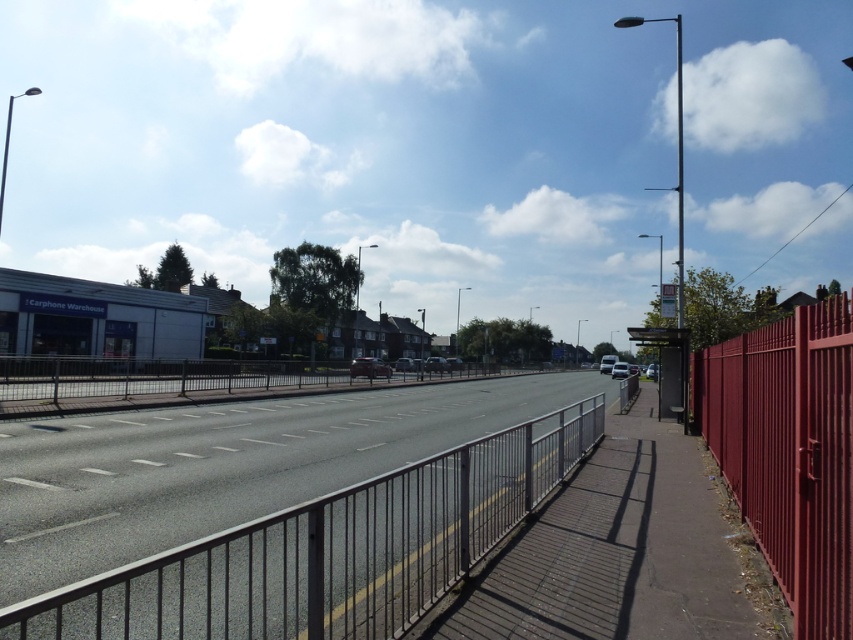
Is the position of metallic silver rail at center less distant than that of smooth glossy red fence at right?

Yes, metallic silver rail at center is in front of smooth glossy red fence at right.

Can you confirm if metallic silver rail at center is positioned above smooth glossy red fence at right?

No.

Locate an element on the screen. The height and width of the screenshot is (640, 853). metallic silver rail at center is located at coordinates (331, 550).